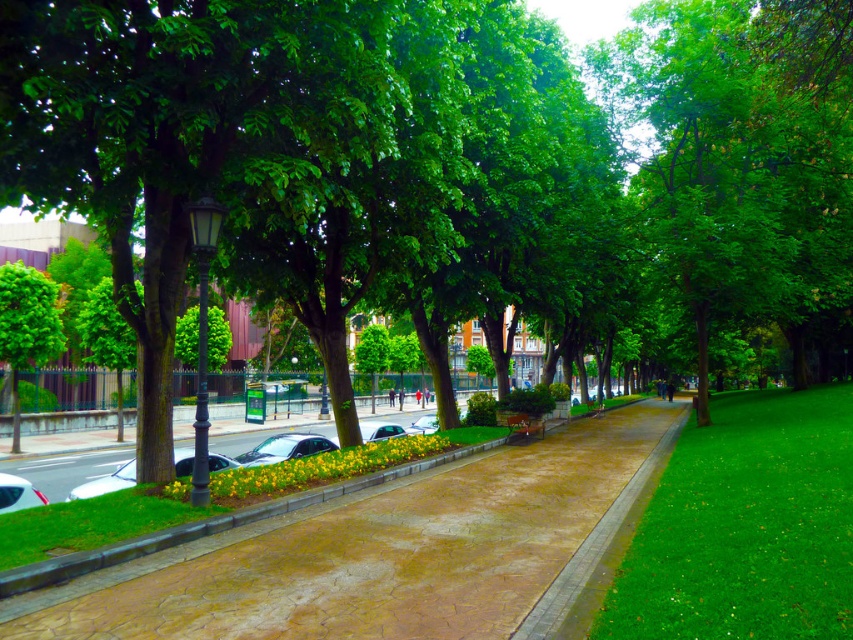
Looking at this image, you are a gardener who needs to water the green grass at right but your hose can only reach 2 meters. The brown textured pavement at center is in the way. Can you water the grass without moving the pavement?

The brown textured pavement at center is positioned on the left side of green grass at right. Since the pavement is only to the left of the grass and not in front, you can water the grass from the right side without needing to move the pavement. The distance may be within the hose reach if positioned correctly.

In the scene shown: You are a maintenance worker tasked with repairing a specific section of the brown textured pavement at center located at point (383, 552). You have a repair kit that covers an area up to 0.5 meters in radius. Can you determine if the repair kit will be sufficient to fix the pavement at that exact point?

The brown textured pavement at center is located at point (383, 552). The repair kit covers an area up to 0.5 meters in radius, so it should be sufficient to fix the pavement at that exact point as long as the damage does not exceed the kit capacity.

You are a gardener planning to walk along the brown textured pavement at center while avoiding the green leafy tree at left. Considering their sizes, which one should you focus on to ensure you stay on the path?

The brown textured pavement at center is wider than the green leafy tree at left, so you should focus on the tree to avoid it while staying on the path.